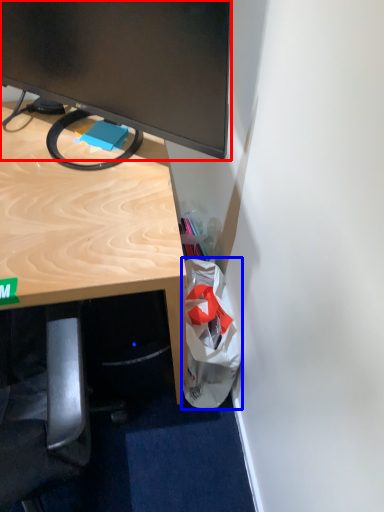
Question: Which of the following is the farthest to the observer, television (highlighted by a red box) or shopping bag (highlighted by a blue box)?

Choices:
 (A) television
 (B) shopping bag

Answer: (B)